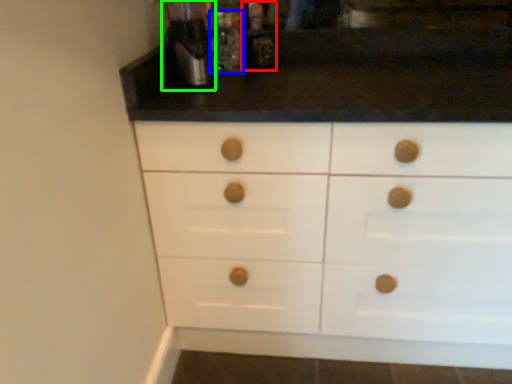
Question: Based on their relative distances, which object is nearer to bottle (highlighted by a red box)? Choose from bottle (highlighted by a blue box) and coffee machine (highlighted by a green box).

Choices:
 (A) bottle
 (B) coffee machine

Answer: (A)